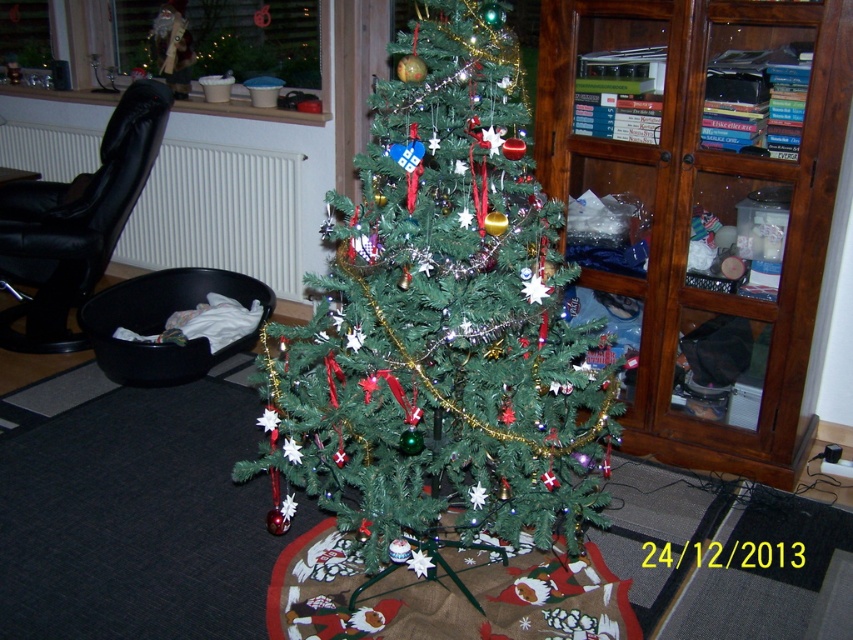
Question: Does green matte christmas tree at center have a greater width compared to wooden cabinet at right?

Choices:
 (A) no
 (B) yes

Answer: (B)

Question: Can you confirm if green matte christmas tree at center is smaller than wooden cabinet at right?

Choices:
 (A) no
 (B) yes

Answer: (A)

Question: Among these points, which one is nearest to the camera?

Choices:
 (A) coord(558,356)
 (B) coord(810,36)

Answer: (A)

Question: Is green matte christmas tree at center bigger than wooden cabinet at right?

Choices:
 (A) no
 (B) yes

Answer: (B)